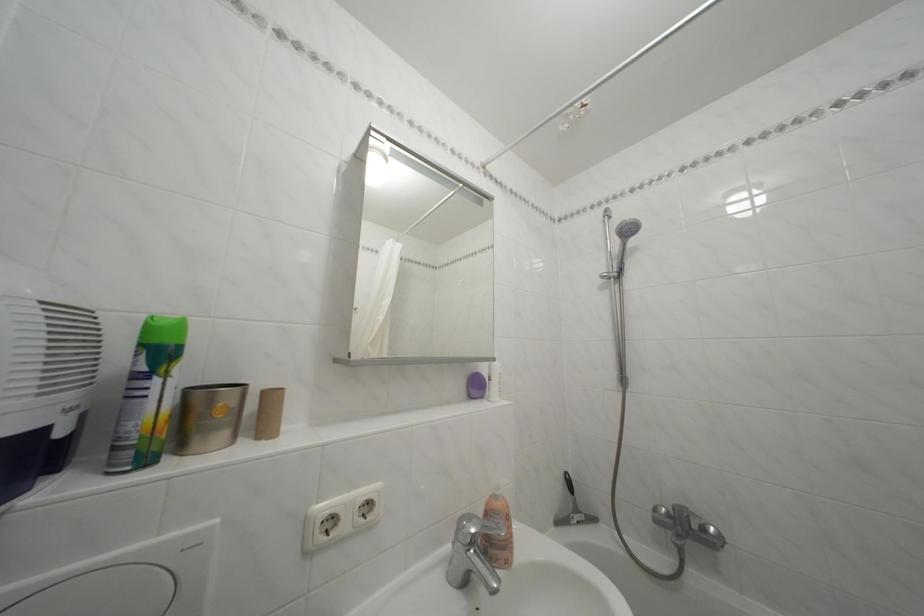
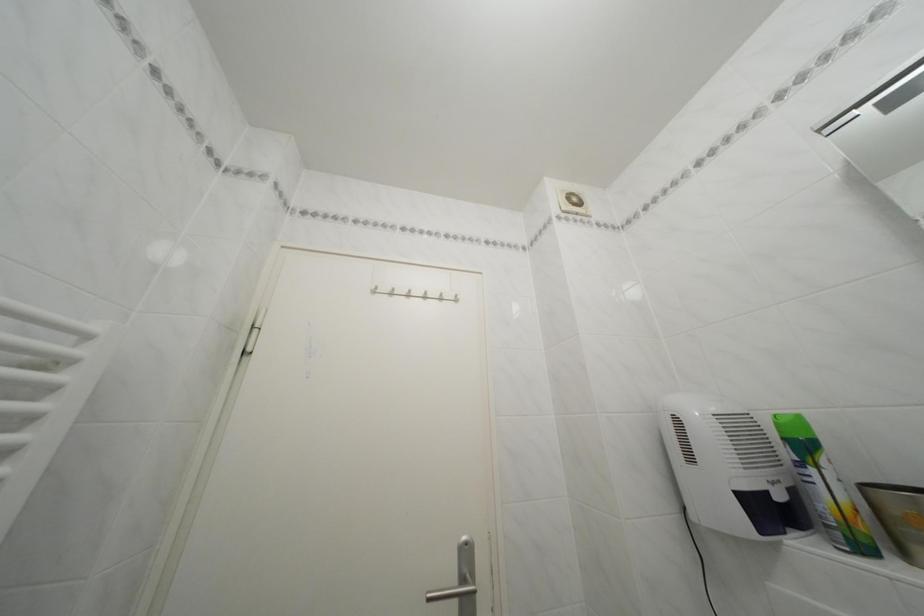
In the second image, find the point that corresponds to point (150, 351) in the first image.

(793, 445)